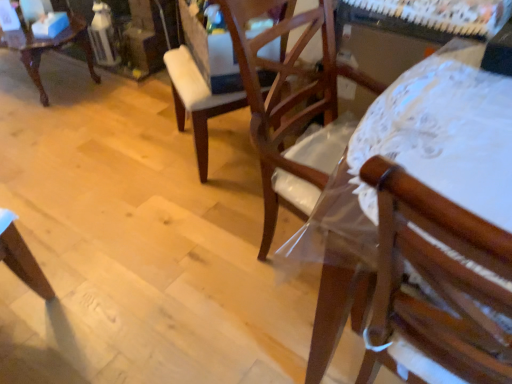
The width and height of the screenshot is (512, 384). In order to click on wooden chair at right, the third chair viewed from the back in this screenshot , I will do `click(428, 218)`.

This screenshot has width=512, height=384. Describe the element at coordinates (50, 48) in the screenshot. I see `matte white chair at upper left, which ranks as the 1th chair in back-to-front order` at that location.

You are a GUI agent. You are given a task and a screenshot of the screen. Output one action in this format:
    pyautogui.click(x=<x>, y=<y>)
    Task: Click on the wooden chair at center, arranged as the second chair when viewed from the left
    The height and width of the screenshot is (384, 512).
    Given the screenshot: What is the action you would take?
    pyautogui.click(x=197, y=100)

Find the location of a particular element. The height and width of the screenshot is (384, 512). wooden chair at right, which ranks as the 1th chair in front-to-back order is located at coordinates (428, 218).

Considering the relative sizes of matte white chair at upper left, which is counted as the first chair, starting from the left, and wooden chair at right, which is counted as the 1th chair, starting from the right, in the image provided, is matte white chair at upper left, which is counted as the first chair, starting from the left, smaller than wooden chair at right, which is counted as the 1th chair, starting from the right,?

No.

From the image's perspective, which one is positioned lower, matte white chair at upper left, the 3th chair from the right, or wooden chair at right, the third chair viewed from the left?

wooden chair at right, the third chair viewed from the left, appears lower in the image.

Between matte white chair at upper left, which ranks as the 1th chair in back-to-front order, and wooden chair at right, the third chair viewed from the back, which one has more height?

With more height is wooden chair at right, the third chair viewed from the back.

Does matte white chair at upper left, the 3th chair from the right, have a lesser width compared to wooden chair at right, the third chair viewed from the left?

In fact, matte white chair at upper left, the 3th chair from the right, might be wider than wooden chair at right, the third chair viewed from the left.

From the image's perspective, who appears lower, matte white chair at upper left, the 3th chair from the right, or wooden chair at center, which ranks as the second chair in front-to-back order?

wooden chair at center, which ranks as the second chair in front-to-back order.

Is matte white chair at upper left, the 3th chair in the front-to-back sequence, outside of wooden chair at center, which ranks as the second chair in front-to-back order?

matte white chair at upper left, the 3th chair in the front-to-back sequence, lies outside wooden chair at center, which ranks as the second chair in front-to-back order,'s area.

Is matte white chair at upper left, which ranks as the 1th chair in back-to-front order, smaller than wooden chair at center, which is the 2th chair from back to front?

Actually, matte white chair at upper left, which ranks as the 1th chair in back-to-front order, might be larger than wooden chair at center, which is the 2th chair from back to front.

Considering the relative sizes of matte white chair at upper left, the 3th chair in the front-to-back sequence, and wooden chair at center, the 2th chair positioned from the right, in the image provided, is matte white chair at upper left, the 3th chair in the front-to-back sequence, wider than wooden chair at center, the 2th chair positioned from the right,?

Indeed, matte white chair at upper left, the 3th chair in the front-to-back sequence, has a greater width compared to wooden chair at center, the 2th chair positioned from the right.

From the image's perspective, is wooden chair at right, the third chair viewed from the back, above wooden chair at center, arranged as the second chair when viewed from the left?

No, from the image's perspective, wooden chair at right, the third chair viewed from the back, is not above wooden chair at center, arranged as the second chair when viewed from the left.

Would you say wooden chair at right, the third chair viewed from the back, is outside wooden chair at center, which is the 2th chair from back to front?

Absolutely, wooden chair at right, the third chair viewed from the back, is external to wooden chair at center, which is the 2th chair from back to front.

Is wooden chair at right, the third chair viewed from the left, not close to wooden chair at center, which ranks as the second chair in front-to-back order?

That's not correct — wooden chair at right, the third chair viewed from the left, is a little close to wooden chair at center, which ranks as the second chair in front-to-back order.

Considering the positions of objects wooden chair at right, which is counted as the 1th chair, starting from the right, and matte white chair at upper left, which ranks as the 1th chair in back-to-front order, in the image provided, who is more to the left, wooden chair at right, which is counted as the 1th chair, starting from the right, or matte white chair at upper left, which ranks as the 1th chair in back-to-front order,?

Positioned to the left is matte white chair at upper left, which ranks as the 1th chair in back-to-front order.

In the image, is wooden chair at right, the third chair viewed from the back, positioned in front of or behind matte white chair at upper left, the 3th chair in the front-to-back sequence?

wooden chair at right, the third chair viewed from the back, is in front of matte white chair at upper left, the 3th chair in the front-to-back sequence.

From the image's perspective, is wooden chair at right, the third chair viewed from the back, above matte white chair at upper left, which is counted as the first chair, starting from the left?

Actually, wooden chair at right, the third chair viewed from the back, appears below matte white chair at upper left, which is counted as the first chair, starting from the left, in the image.

Could you measure the distance between wooden chair at right, the third chair viewed from the back, and matte white chair at upper left, the 3th chair in the front-to-back sequence?

wooden chair at right, the third chair viewed from the back, is 2.46 meters away from matte white chair at upper left, the 3th chair in the front-to-back sequence.

Where is `chair that is above the wooden chair at center, which is the 2th chair from back to front (from the image's perspective)`? chair that is above the wooden chair at center, which is the 2th chair from back to front (from the image's perspective) is located at coordinates (50, 48).

Is wooden chair at center, which ranks as the second chair in front-to-back order, aimed at matte white chair at upper left, the 3th chair from the right?

No, wooden chair at center, which ranks as the second chair in front-to-back order, is not oriented towards matte white chair at upper left, the 3th chair from the right.

Does wooden chair at center, arranged as the second chair when viewed from the left, appear on the left side of matte white chair at upper left, the 3th chair in the front-to-back sequence?

Incorrect, wooden chair at center, arranged as the second chair when viewed from the left, is not on the left side of matte white chair at upper left, the 3th chair in the front-to-back sequence.

From the image's perspective, which chair is the 1st one above the wooden chair at right, the third chair viewed from the back? Please provide its 2D coordinates.

[(197, 100)]

Considering the sizes of objects wooden chair at center, the 2th chair positioned from the right, and wooden chair at right, which is counted as the 1th chair, starting from the right, in the image provided, who is shorter, wooden chair at center, the 2th chair positioned from the right, or wooden chair at right, which is counted as the 1th chair, starting from the right,?

wooden chair at center, the 2th chair positioned from the right, is shorter.

Is wooden chair at center, which ranks as the second chair in front-to-back order, in front of or behind wooden chair at right, the third chair viewed from the left, in the image?

Clearly, wooden chair at center, which ranks as the second chair in front-to-back order, is behind wooden chair at right, the third chair viewed from the left.

Is wooden chair at center, which ranks as the second chair in front-to-back order, positioned far away from wooden chair at right, the third chair viewed from the left?

wooden chair at center, which ranks as the second chair in front-to-back order, is actually quite close to wooden chair at right, the third chair viewed from the left.

Where is `the 2nd chair above when counting from the wooden chair at right, which is counted as the 1th chair, starting from the right (from the image's perspective)`? The width and height of the screenshot is (512, 384). the 2nd chair above when counting from the wooden chair at right, which is counted as the 1th chair, starting from the right (from the image's perspective) is located at coordinates (50, 48).

I want to click on chair on the left of wooden chair at center, which is the 2th chair from back to front, so click(x=50, y=48).

When comparing their distances from wooden chair at right, the third chair viewed from the left, does matte white chair at upper left, which ranks as the 1th chair in back-to-front order, or wooden chair at center, arranged as the second chair when viewed from the left, seem closer?

Among the two, wooden chair at center, arranged as the second chair when viewed from the left, is located nearer to wooden chair at right, the third chair viewed from the left.

Based on the photo, when comparing their distances from wooden chair at right, the third chair viewed from the left, does wooden chair at center, arranged as the second chair when viewed from the left, or matte white chair at upper left, the 3th chair in the front-to-back sequence, seem further?

matte white chair at upper left, the 3th chair in the front-to-back sequence.

Estimate the real-world distances between objects in this image. Which object is closer to wooden chair at center, the 2th chair positioned from the right, wooden chair at right, the third chair viewed from the back, or matte white chair at upper left, the 3th chair from the right?

The object closer to wooden chair at center, the 2th chair positioned from the right, is wooden chair at right, the third chair viewed from the back.

Estimate the real-world distances between objects in this image. Which object is further from matte white chair at upper left, the 3th chair in the front-to-back sequence, wooden chair at right, which ranks as the 1th chair in front-to-back order, or wooden chair at center, which is the 2th chair from back to front?

Based on the image, wooden chair at right, which ranks as the 1th chair in front-to-back order, appears to be further to matte white chair at upper left, the 3th chair in the front-to-back sequence.

Looking at the image, which one is located further to wooden chair at center, the 2th chair positioned from the right, matte white chair at upper left, which ranks as the 1th chair in back-to-front order, or wooden chair at right, the third chair viewed from the back?

The object further to wooden chair at center, the 2th chair positioned from the right, is matte white chair at upper left, which ranks as the 1th chair in back-to-front order.

Based on their spatial positions, is wooden chair at center, which ranks as the second chair in front-to-back order, or wooden chair at right, the third chair viewed from the left, closer to matte white chair at upper left, which ranks as the 1th chair in back-to-front order?

Among the two, wooden chair at center, which ranks as the second chair in front-to-back order, is located nearer to matte white chair at upper left, which ranks as the 1th chair in back-to-front order.

Where is `chair between matte white chair at upper left, the 3th chair from the right, and wooden chair at right, which is counted as the 1th chair, starting from the right, from left to right`? chair between matte white chair at upper left, the 3th chair from the right, and wooden chair at right, which is counted as the 1th chair, starting from the right, from left to right is located at coordinates (197, 100).